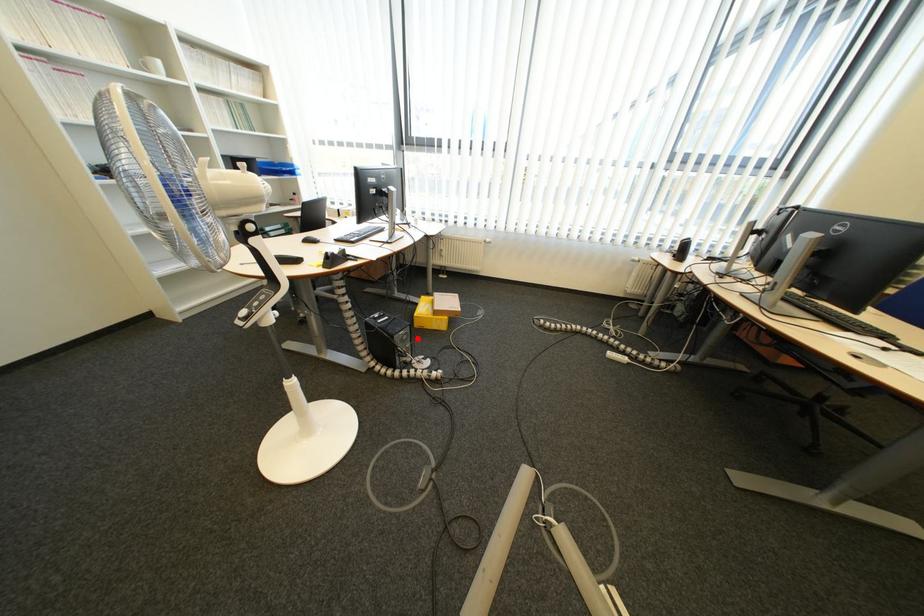
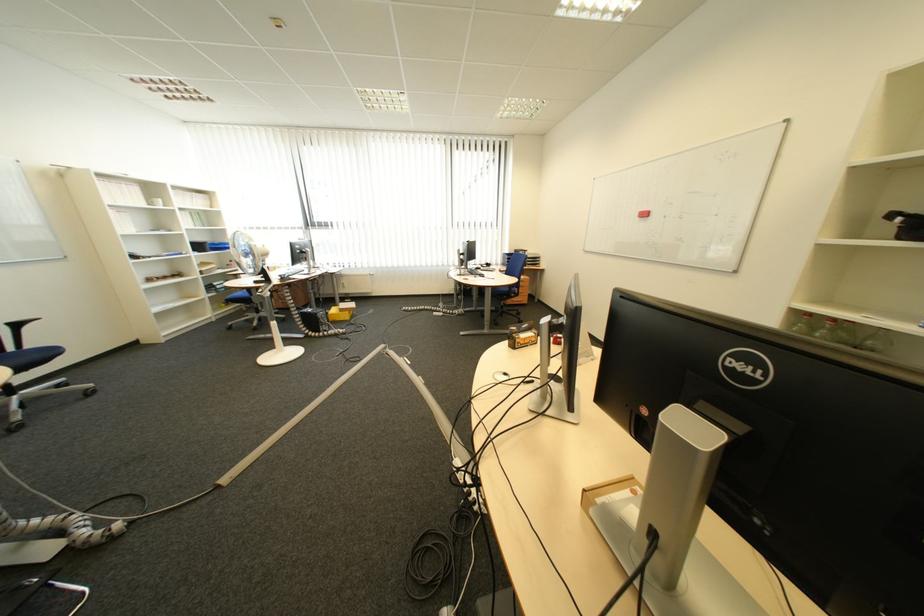
Where in the second image is the point corresponding to the highlighted location from the first image?

(335, 317)